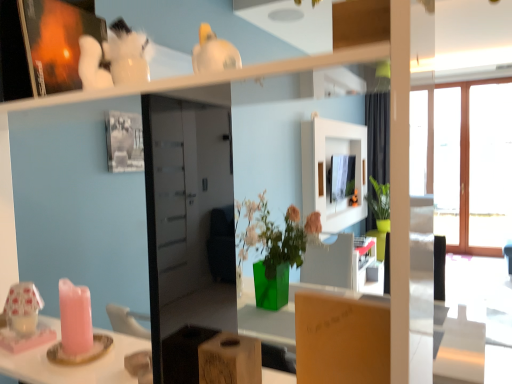
Question: Based on their positions, is matte brown cardboard box at center, the first cardboard box from the right, located to the left or right of wooden frame at right?

Choices:
 (A) right
 (B) left

Answer: (B)

Question: In the image, is matte brown cardboard box at center, the first cardboard box from the right, positioned in front of or behind wooden frame at right?

Choices:
 (A) front
 (B) behind

Answer: (A)

Question: Which object is positioned farthest from the wooden frame at right?

Choices:
 (A) matte brown cardboard box at center, the first cardboard box from the right
 (B) wooden block at center, the first cardboard box from the left

Answer: (B)

Question: Considering the real-world distances, which object is farthest from the matte brown cardboard box at center, the first cardboard box from the right?

Choices:
 (A) wooden block at center, which is the second cardboard box in right-to-left order
 (B) wooden frame at right

Answer: (B)